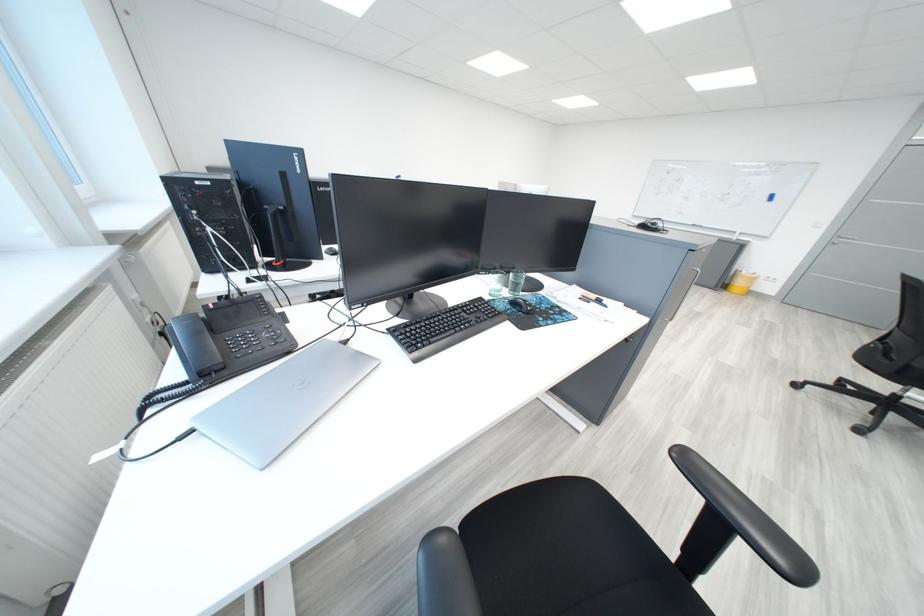
What do you see at coordinates (591, 299) in the screenshot?
I see `a orange pen` at bounding box center [591, 299].